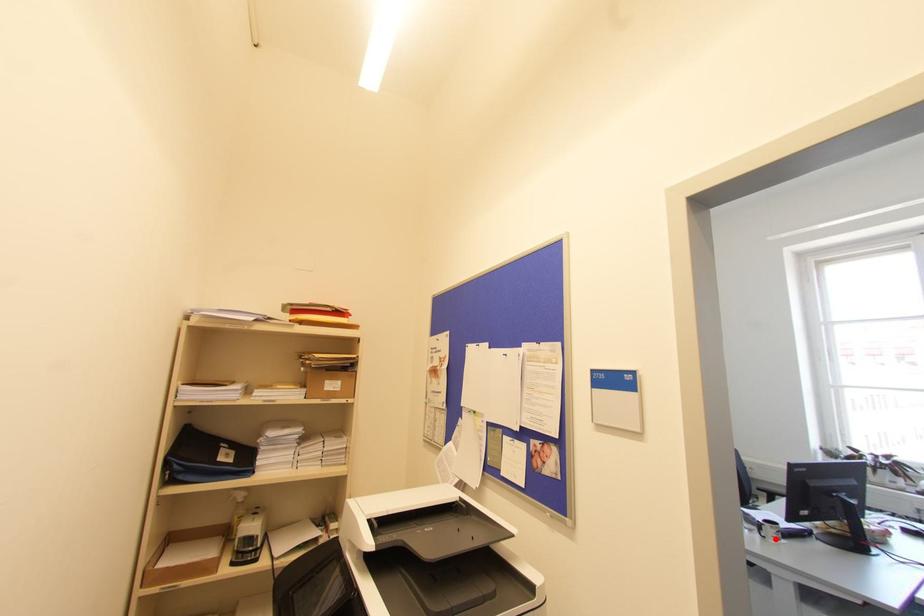
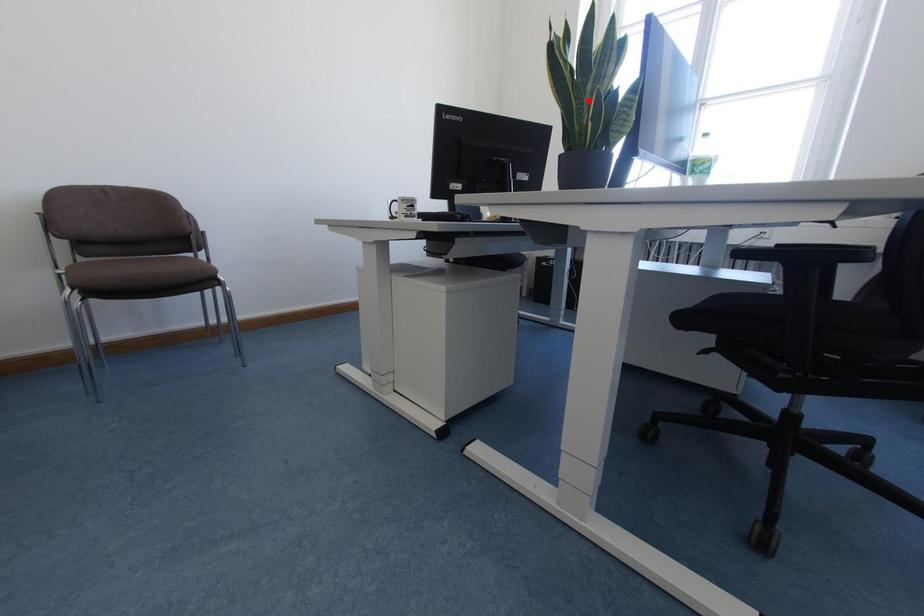
I am providing you with two images of the same scene from different viewpoints. A red point is marked on the first image and another point is marked on the second image. Do the highlighted points in image1 and image2 indicate the same real-world spot?

No